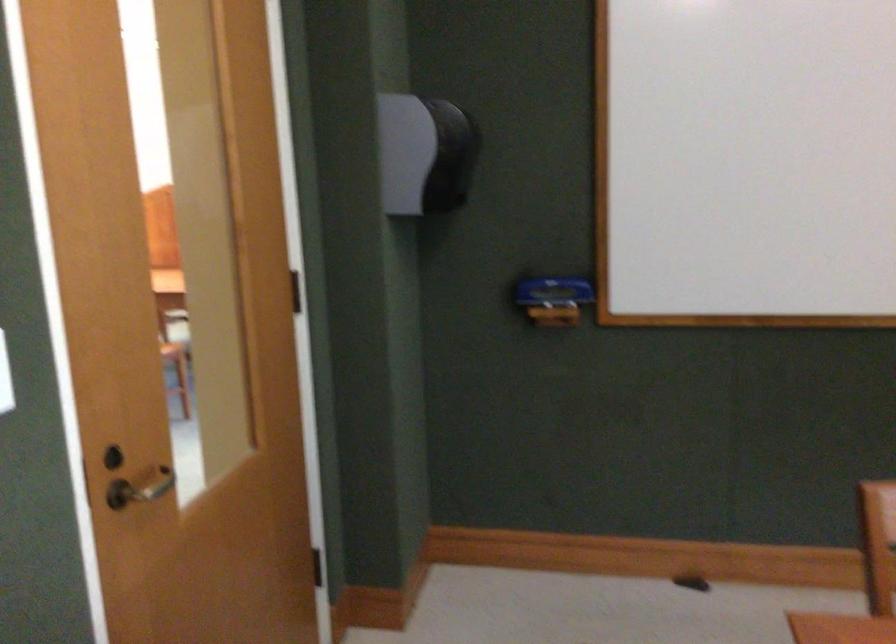
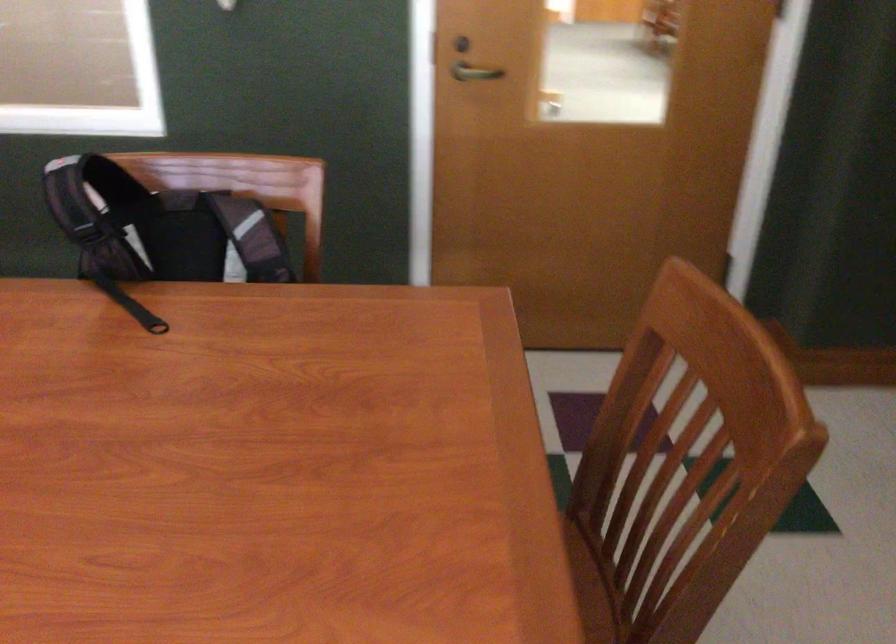
Where in the second image is the point corresponding to the point at 97,468 from the first image?

(460, 44)